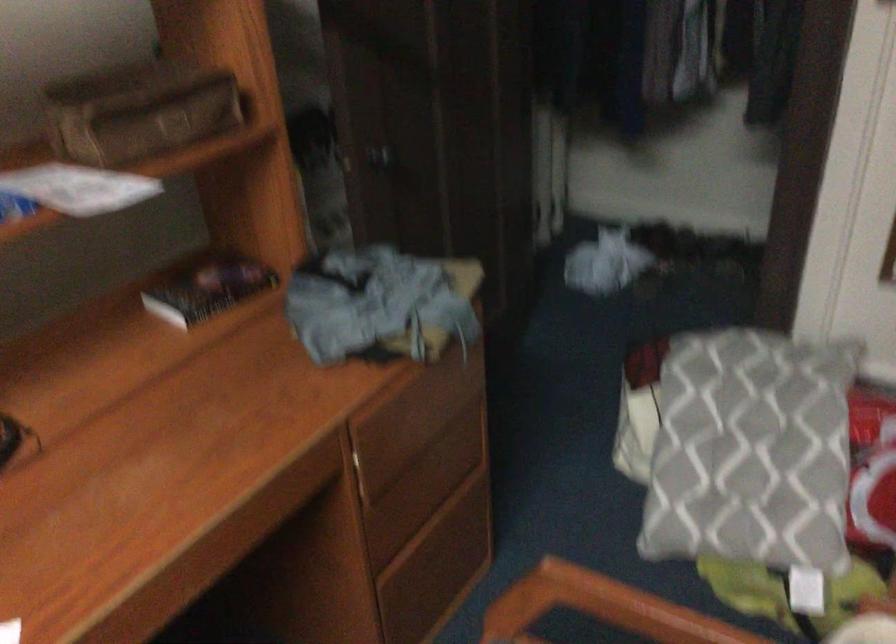
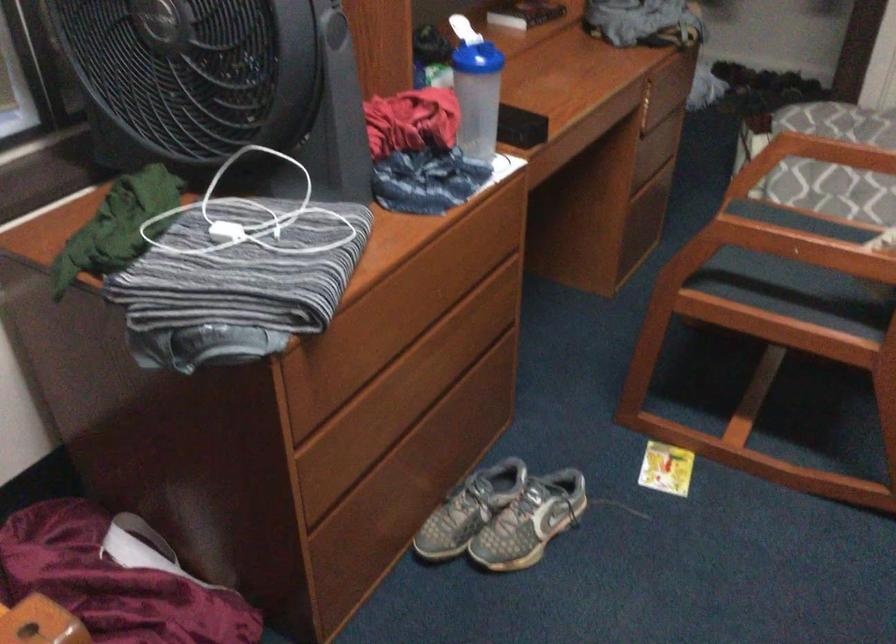
Find the pixel in the second image that matches the point at 397,549 in the first image.

(643, 169)